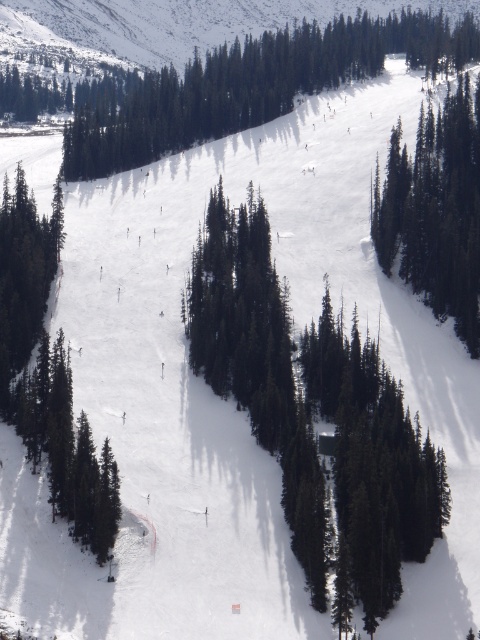
Can you confirm if green coniferous trees at upper center is shorter than green matte tree at left?

Incorrect, green coniferous trees at upper center's height does not fall short of green matte tree at left's.

Is point (94, 122) closer to camera compared to point (28, 324)?

No, it is behind (28, 324).

This screenshot has width=480, height=640. What are the coordinates of `green coniferous trees at upper center` in the screenshot? It's located at (249, 84).

In order to click on green coniferous trees at upper center in this screenshot , I will do `click(249, 84)`.

Between point (336, 326) and point (92, 449), which one is positioned behind?

The point (336, 326) is more distant.

Describe the element at coordinates (317, 410) in the screenshot. The width and height of the screenshot is (480, 640). I see `green coniferous trees at center` at that location.

This screenshot has width=480, height=640. Find the location of `green coniferous trees at center`. green coniferous trees at center is located at coordinates (317, 410).

Locate an element on the screen. green coniferous trees at center is located at coordinates (317, 410).

Between green coniferous trees at center and green matte tree at center-right, which one is positioned higher?

green matte tree at center-right

Is the position of green coniferous trees at center more distant than that of green matte tree at center-right?

No, green coniferous trees at center is closer to the viewer.

Is point (375, 440) positioned in front of point (443, 269)?

Yes, it is.

The height and width of the screenshot is (640, 480). In order to click on green coniferous trees at center in this screenshot , I will do `click(317, 410)`.